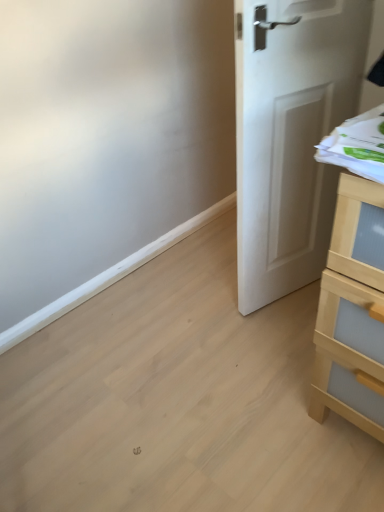
Identify the location of free location in front of white matte door at center. Image resolution: width=384 pixels, height=512 pixels. (280, 348).